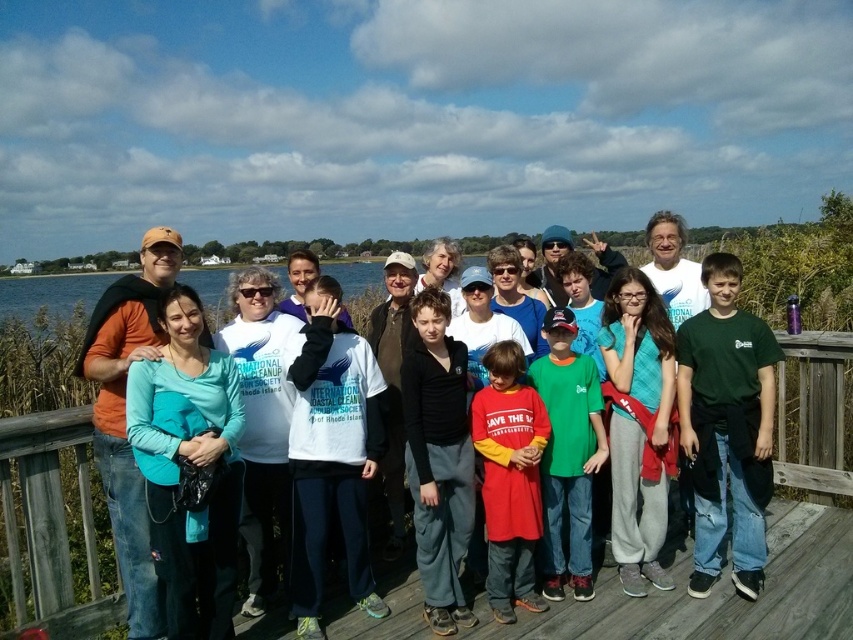
Question: Which of these objects is positioned closest to the matte orange shirt at left?

Choices:
 (A) black cotton shirt at center
 (B) green cotton shirt at center
 (C) red cotton shirt at center

Answer: (A)

Question: Which of the following is the closest to the observer?

Choices:
 (A) (111, 515)
 (B) (746, 500)

Answer: (A)

Question: Does green matte shirt at center-right have a smaller size compared to matte orange shirt at left?

Choices:
 (A) no
 (B) yes

Answer: (B)

Question: Is white cotton shirt at center wider than green cotton shirt at center?

Choices:
 (A) yes
 (B) no

Answer: (A)

Question: Which object appears closest to the camera in this image?

Choices:
 (A) white cotton shirt at center
 (B) black cotton shirt at center
 (C) matte orange shirt at left

Answer: (C)

Question: Can you confirm if green matte shirt at center-right is thinner than green cotton shirt at center?

Choices:
 (A) yes
 (B) no

Answer: (B)